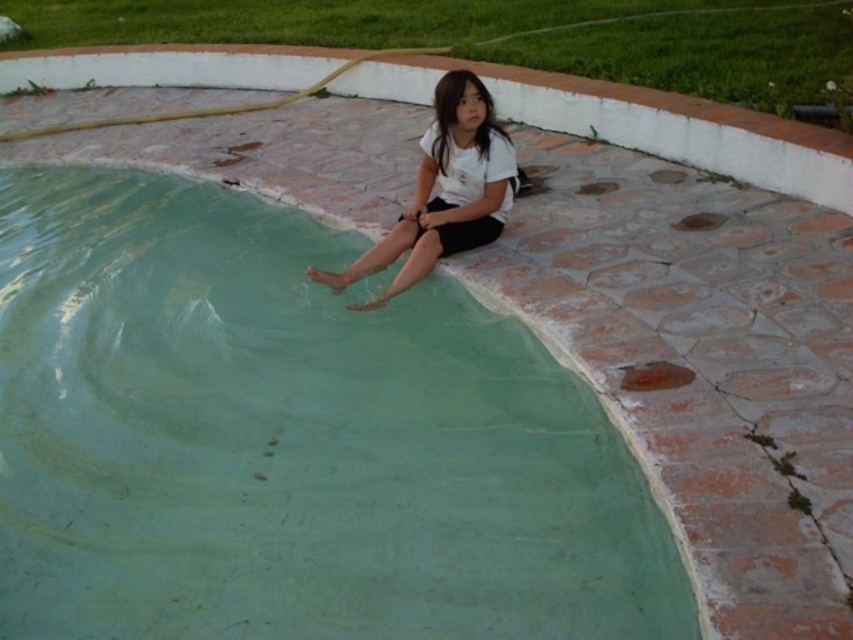
You are standing at the edge of the green concrete swimming pool at upper center and the white matte shirt at upper center. Which object is closer to your right side?

The white matte shirt at upper center is closer to your right side because the green concrete swimming pool at upper center is to the left of it.

You are standing at the point marked as point (x=289, y=440) in the image. What object is located exactly at that point?

The green concrete swimming pool at upper center is located exactly at point (x=289, y=440).